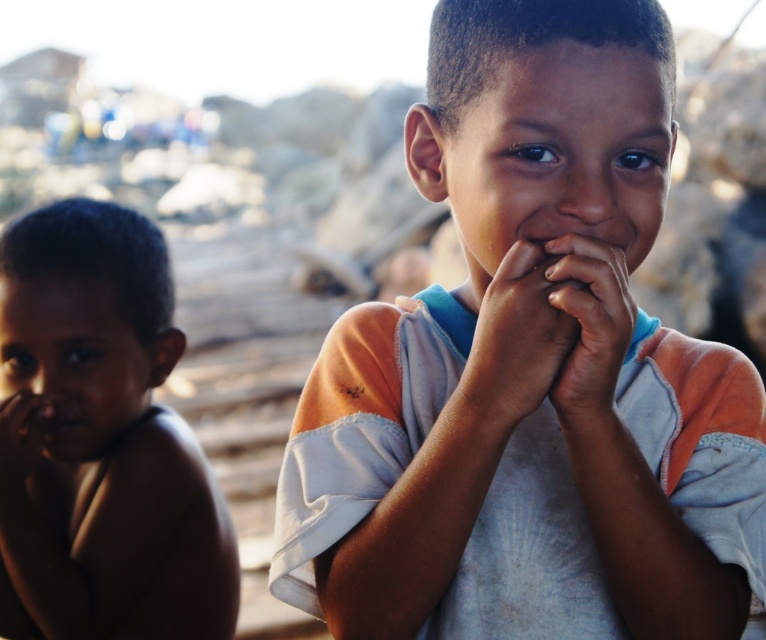
Identify the location of white cotton shirt at center. The width and height of the screenshot is (766, 640). (529, 376).

Between white cotton shirt at center and smooth skin child at left, which one appears on the right side from the viewer's perspective?

white cotton shirt at center is more to the right.

The image size is (766, 640). Identify the location of white cotton shirt at center. (529, 376).

How far apart are dark skin hand at center and smooth skin hands at center?

3.67 centimeters

Does point (508, 410) lie behind point (555, 284)?

Yes, point (508, 410) is behind point (555, 284).

Measure the distance between point (529, 352) and camera.

The distance of point (529, 352) from camera is 1.06 meters.

I want to click on dark skin hand at center, so click(x=516, y=339).

Does dark skin hand at center come behind smooth skin hand at left?

That is False.

Is point (506, 266) positioned after point (25, 412)?

No, it is in front of (25, 412).

Between point (503, 372) and point (35, 435), which one is positioned behind?

The point (35, 435) is behind.

Identify the location of dark skin hand at center. The height and width of the screenshot is (640, 766). (516, 339).